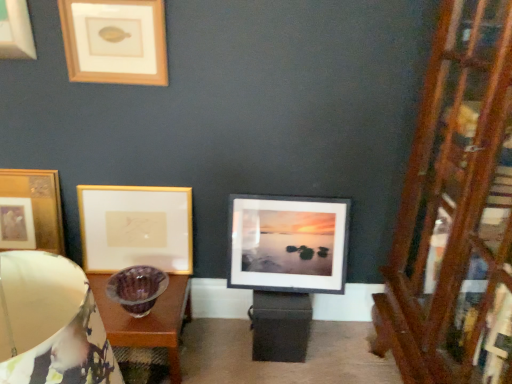
Question: From a real-world perspective, is gold/glossy picture frame at upper left, marked as the second picture frame in a left-to-right arrangement, positioned over matte purple glass bowl at left based on gravity?

Choices:
 (A) no
 (B) yes

Answer: (A)

Question: Is gold/glossy picture frame at upper left, marked as the second picture frame in a left-to-right arrangement, positioned far away from matte purple glass bowl at left?

Choices:
 (A) no
 (B) yes

Answer: (B)

Question: From a real-world perspective, is gold/glossy picture frame at upper left, the 3th picture frame in the right-to-left sequence, located beneath matte purple glass bowl at left?

Choices:
 (A) no
 (B) yes

Answer: (B)

Question: Is gold/glossy picture frame at upper left, marked as the second picture frame in a left-to-right arrangement, aimed at matte purple glass bowl at left?

Choices:
 (A) no
 (B) yes

Answer: (B)

Question: Can you confirm if gold/glossy picture frame at upper left, marked as the second picture frame in a left-to-right arrangement, is positioned to the left of matte purple glass bowl at left?

Choices:
 (A) yes
 (B) no

Answer: (A)

Question: Can you confirm if gold/glossy picture frame at upper left, the 3th picture frame in the right-to-left sequence, is thinner than matte purple glass bowl at left?

Choices:
 (A) no
 (B) yes

Answer: (B)

Question: Is matte purple glass bowl at left positioned beyond the bounds of gold/matte picture frame at upper left, the 3th picture frame positioned from the left?

Choices:
 (A) yes
 (B) no

Answer: (A)

Question: Is matte purple glass bowl at left aimed at gold/matte picture frame at upper left, the 3th picture frame positioned from the left?

Choices:
 (A) yes
 (B) no

Answer: (B)

Question: Is matte purple glass bowl at left smaller than gold/matte picture frame at upper left, the 3th picture frame positioned from the left?

Choices:
 (A) no
 (B) yes

Answer: (A)

Question: Does matte purple glass bowl at left have a larger size compared to gold/matte picture frame at upper left, the 3th picture frame positioned from the left?

Choices:
 (A) no
 (B) yes

Answer: (B)

Question: From a real-world perspective, is matte purple glass bowl at left below gold/matte picture frame at upper left, the 3th picture frame positioned from the left?

Choices:
 (A) yes
 (B) no

Answer: (A)

Question: Considering the relative positions of matte purple glass bowl at left and gold/matte picture frame at upper left, the second picture frame from the right, in the image provided, is matte purple glass bowl at left in front of gold/matte picture frame at upper left, the second picture frame from the right,?

Choices:
 (A) yes
 (B) no

Answer: (A)

Question: Can you confirm if wooden at right is smaller than gold/matte picture frame at upper left, the second picture frame from the right?

Choices:
 (A) no
 (B) yes

Answer: (A)